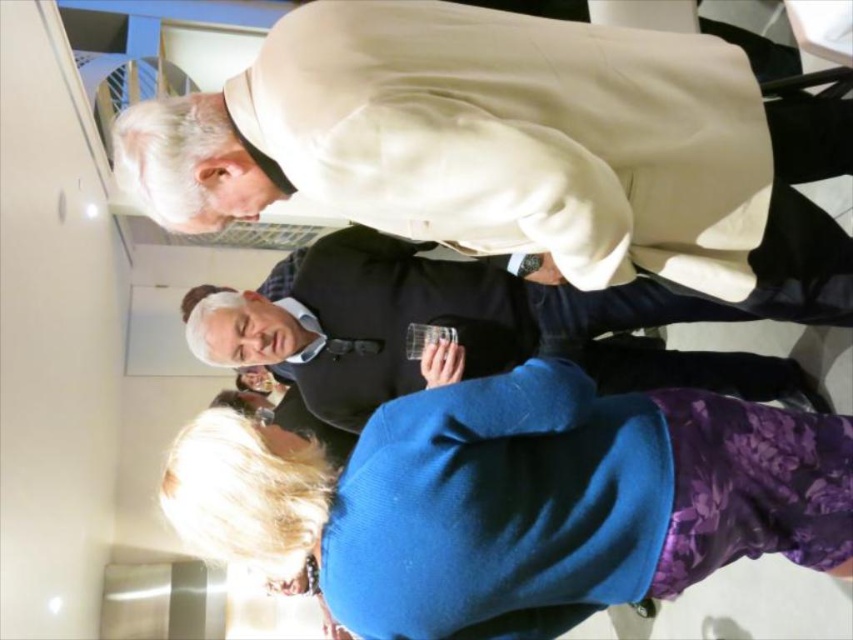
You are organizing a charity event and need to place a 12x12 inch donation box between the blue woolen sweater at lower center and the matte black vest at center. Considering their sizes, will the box fit between them?

The blue woolen sweater at lower center is smaller than the matte black vest at center, so the 12x12 inch donation box may fit between them if the space between the two objects is sufficient. However, the exact placement depends on the distance between them, which isn

You are organizing a clothing display and need to place the light beige fabric coat at upper center and the matte black vest at center next to each other. Based on their sizes, which one should be placed on the left to ensure they fit within a 1.2 meter wide display stand?

The light beige fabric coat at upper center has a smaller width than the matte black vest at center, so placing the light beige fabric coat at upper center on the left would allow both items to fit within the 1.2 meter wide display stand.

You are a photographer positioned at the back of the room. You want to take a photo of the blue woolen sweater at lower center and the matte black vest at center. Which one will appear larger in your photo?

The blue woolen sweater at lower center will appear larger in the photo because it is closer to the viewer than the matte black vest at center.